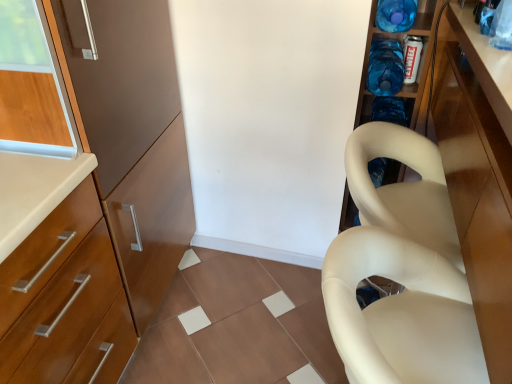
Question: In terms of height, does blue plastic bottle at upper right, which ranks as the first bottle in bottom-to-top order, look taller or shorter compared to glossy wood cabinet at right?

Choices:
 (A) short
 (B) tall

Answer: (A)

Question: From the image's perspective, is blue plastic bottle at upper right, which ranks as the first bottle in bottom-to-top order, located above or below glossy wood cabinet at right?

Choices:
 (A) below
 (B) above

Answer: (B)

Question: Estimate the real-world distances between objects in this image. Which object is farther from the glossy wood cabinet at right?

Choices:
 (A) beige matte plastic chair at right
 (B) blue plastic bottle at upper right, which ranks as the first bottle in bottom-to-top order
 (C) blue translucent bottle at upper right, which is counted as the 1th bottle, starting from the top

Answer: (C)

Question: Which of these objects is positioned closest to the blue translucent bottle at upper right, which is counted as the 1th bottle, starting from the top?

Choices:
 (A) glossy wood cabinet at right
 (B) blue plastic bottle at upper right, which ranks as the first bottle in bottom-to-top order
 (C) beige matte plastic chair at right

Answer: (B)